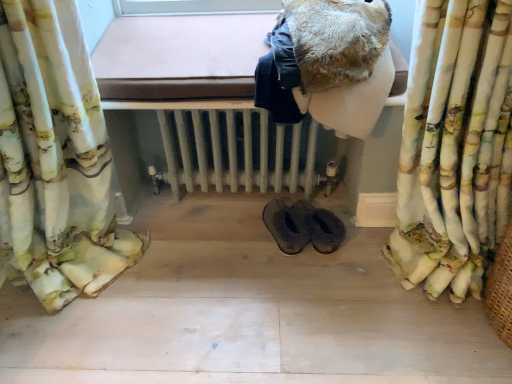
Question: From their relative heights in the image, would you say fluffy fabric curtain at right is taller or shorter than white painted radiator at center?

Choices:
 (A) tall
 (B) short

Answer: (A)

Question: In terms of width, does fluffy fabric curtain at right look wider or thinner when compared to white painted radiator at center?

Choices:
 (A) thin
 (B) wide

Answer: (A)

Question: Based on their relative distances, which object is nearer to the white painted radiator at center?

Choices:
 (A) black leather slippers at center
 (B) fuzzy brown blanket at upper center
 (C) fluffy fabric curtain at right

Answer: (A)

Question: Estimate the real-world distances between objects in this image. Which object is closer to the fuzzy brown blanket at upper center?

Choices:
 (A) black leather slippers at center
 (B) fluffy fabric curtain at right
 (C) white painted radiator at center

Answer: (B)